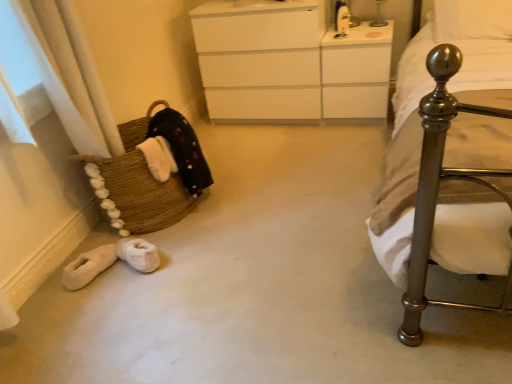
The height and width of the screenshot is (384, 512). What do you see at coordinates (472, 19) in the screenshot? I see `white soft pillow at upper right` at bounding box center [472, 19].

What do you see at coordinates (450, 157) in the screenshot? The width and height of the screenshot is (512, 384). I see `polished metal bed at right` at bounding box center [450, 157].

Identify the location of white soft pillow at upper right. This screenshot has width=512, height=384. (472, 19).

Can you confirm if white glossy vanity at upper center is thinner than white soft pillow at upper right?

In fact, white glossy vanity at upper center might be wider than white soft pillow at upper right.

Does white glossy vanity at upper center have a lesser height compared to white soft pillow at upper right?

In fact, white glossy vanity at upper center may be taller than white soft pillow at upper right.

From the image's perspective, is white glossy vanity at upper center above or below white soft pillow at upper right?

white glossy vanity at upper center is below white soft pillow at upper right.

How different are the orientations of white glossy vanity at upper center and white soft pillow at upper right in degrees?

They differ by 2.8 degrees in their facing directions.

From a real-world perspective, is white matte chest of drawers at center beneath metallic glass table lamp at upper center?

Indeed, from a real-world perspective, white matte chest of drawers at center is positioned beneath metallic glass table lamp at upper center.

Choose the correct answer: Is white matte chest of drawers at center inside metallic glass table lamp at upper center or outside it?

white matte chest of drawers at center is spatially situated outside metallic glass table lamp at upper center.

Considering the sizes of white matte chest of drawers at center and metallic glass table lamp at upper center in the image, is white matte chest of drawers at center wider or thinner than metallic glass table lamp at upper center?

Considering their sizes, white matte chest of drawers at center looks broader than metallic glass table lamp at upper center.

Does white matte chest of drawers at center have a greater height compared to metallic glass table lamp at upper center?

Indeed, white matte chest of drawers at center has a greater height compared to metallic glass table lamp at upper center.

Can you confirm if polished metal bed at right is thinner than white matte chest of drawers at center?

No, polished metal bed at right is not thinner than white matte chest of drawers at center.

Can you tell me how much polished metal bed at right and white matte chest of drawers at center differ in facing direction?

The angular difference between polished metal bed at right and white matte chest of drawers at center is 1.53 degrees.

Is polished metal bed at right to the left of white matte chest of drawers at center from the viewer's perspective?

No.

Which is in front, point (476, 29) or point (406, 196)?

The point (406, 196) is closer.

Considering the positions of objects white soft pillow at upper right and polished metal bed at right in the image provided, who is more to the left, white soft pillow at upper right or polished metal bed at right?

polished metal bed at right is more to the left.

From the image's perspective, which one is positioned higher, white soft pillow at upper right or polished metal bed at right?

white soft pillow at upper right is shown above in the image.

Considering the positions of objects white glossy vanity at upper center and metallic glass table lamp at upper center in the image provided, who is in front, white glossy vanity at upper center or metallic glass table lamp at upper center?

white glossy vanity at upper center is closer to the camera.

Is white glossy vanity at upper center taller than metallic glass table lamp at upper center?

Indeed, white glossy vanity at upper center has a greater height compared to metallic glass table lamp at upper center.

Is white glossy vanity at upper center thinner than metallic glass table lamp at upper center?

Incorrect, the width of white glossy vanity at upper center is not less than that of metallic glass table lamp at upper center.

Considering the relative positions of white glossy vanity at upper center and metallic glass table lamp at upper center in the image provided, is white glossy vanity at upper center to the left of metallic glass table lamp at upper center from the viewer's perspective?

Yes.

Which is in front, point (381, 9) or point (471, 30)?

Positioned in front is point (471, 30).

Looking at their sizes, would you say metallic glass table lamp at upper center is wider or thinner than white soft pillow at upper right?

metallic glass table lamp at upper center is thinner than white soft pillow at upper right.

Which object is positioned more to the left, metallic glass table lamp at upper center or white soft pillow at upper right?

From the viewer's perspective, metallic glass table lamp at upper center appears more on the left side.

Relative to white soft pillow at upper right, is metallic glass table lamp at upper center in front or behind?

metallic glass table lamp at upper center is behind white soft pillow at upper right.

Are metallic glass table lamp at upper center and white glossy vanity at upper center making contact?

metallic glass table lamp at upper center and white glossy vanity at upper center are clearly separated.

Does metallic glass table lamp at upper center have a lesser width compared to white glossy vanity at upper center?

Correct, the width of metallic glass table lamp at upper center is less than that of white glossy vanity at upper center.

Measure the distance from metallic glass table lamp at upper center to white glossy vanity at upper center.

A distance of 14.90 inches exists between metallic glass table lamp at upper center and white glossy vanity at upper center.

Is metallic glass table lamp at upper center situated inside white glossy vanity at upper center or outside?

metallic glass table lamp at upper center cannot be found inside white glossy vanity at upper center.

Identify the location of pillow lying on the right of white glossy vanity at upper center. (472, 19).

Image resolution: width=512 pixels, height=384 pixels. I want to click on the chest of drawers directly beneath the metallic glass table lamp at upper center (from a real-world perspective), so click(287, 63).

When comparing their distances from brown woven basket at left, does white matte chest of drawers at center or polished metal bed at right seem further?

Answer: polished metal bed at right lies further to brown woven basket at left than the other object.

From the image, which object appears to be farther from metallic glass table lamp at upper center, polished metal bed at right or white soft pillow at upper right?

polished metal bed at right is positioned further to the anchor metallic glass table lamp at upper center.

When comparing their distances from brown woven basket at left, does white matte chest of drawers at center or white soft pillow at upper right seem further?

Based on the image, white soft pillow at upper right appears to be further to brown woven basket at left.

Estimate the real-world distances between objects in this image. Which object is closer to white glossy vanity at upper center, metallic glass table lamp at upper center or white soft pillow at upper right?

metallic glass table lamp at upper center.

Based on their spatial positions, is metallic glass table lamp at upper center or brown woven basket at left further from white matte chest of drawers at center?

Based on the image, brown woven basket at left appears to be further to white matte chest of drawers at center.

Based on their spatial positions, is white matte chest of drawers at center or brown woven basket at left closer to metallic glass table lamp at upper center?

The object closer to metallic glass table lamp at upper center is white matte chest of drawers at center.

Based on their spatial positions, is metallic glass table lamp at upper center or white matte chest of drawers at center closer to polished metal bed at right?

white matte chest of drawers at center lies closer to polished metal bed at right than the other object.

Estimate the real-world distances between objects in this image. Which object is closer to metallic glass table lamp at upper center, white matte chest of drawers at center or white soft pillow at upper right?

white soft pillow at upper right.

This screenshot has width=512, height=384. Find the location of `bed situated between brown woven basket at left and white soft pillow at upper right from left to right`. bed situated between brown woven basket at left and white soft pillow at upper right from left to right is located at coordinates (450, 157).

At what (x,y) coordinates should I click in order to perform the action: click on the chest of drawers located between brown woven basket at left and white glossy vanity at upper center in the left-right direction. Please return your answer as a coordinate pair (x, y). The image size is (512, 384). Looking at the image, I should click on (287, 63).

Identify the location of vanity between brown woven basket at left and white soft pillow at upper right from left to right. The height and width of the screenshot is (384, 512). click(x=356, y=72).

Locate an element on the screen. vanity located between white matte chest of drawers at center and metallic glass table lamp at upper center in the left-right direction is located at coordinates (356, 72).